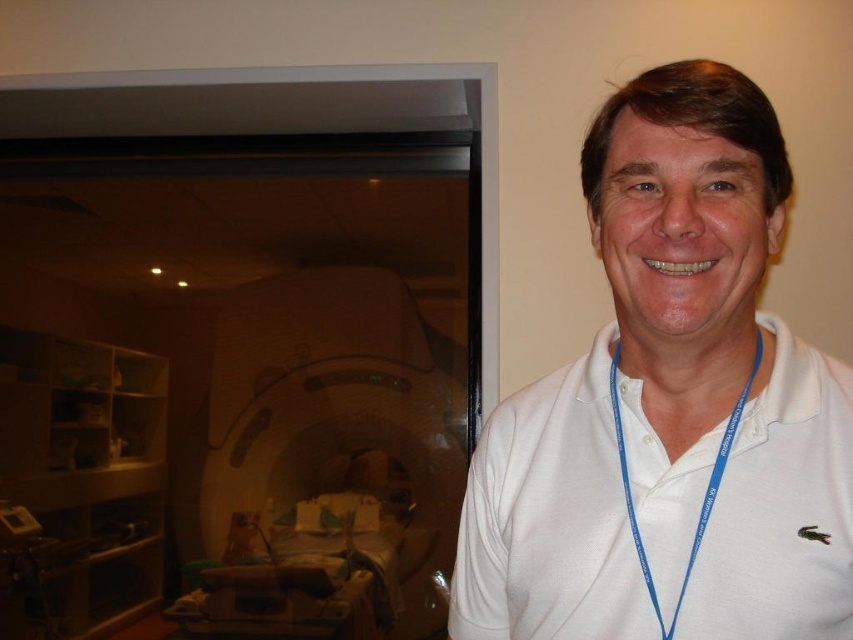
You are a healthcare worker in the room and need to reach the point at coordinates point (805,627). Your arm is 60 centimeters long. Can you reach it without moving your feet?

The point (805,627) is 58.06 centimeters from the viewer. Since your arm is 60 centimeters long, you can reach it without moving your feet.

You are a healthcare worker entering a room and see a man wearing a white cotton polo shirt at center and a white smooth neck at center. Which clothing item is taller on him?

The white cotton polo shirt at center is taller than the white smooth neck at center.

Please answer based on the scene description. Is the point at coordinates (x=670, y=406) located on the man or the medical imaging machine?

The point at coordinates (x=670, y=406) is located on the white cotton polo shirt at center, which is part of the man.